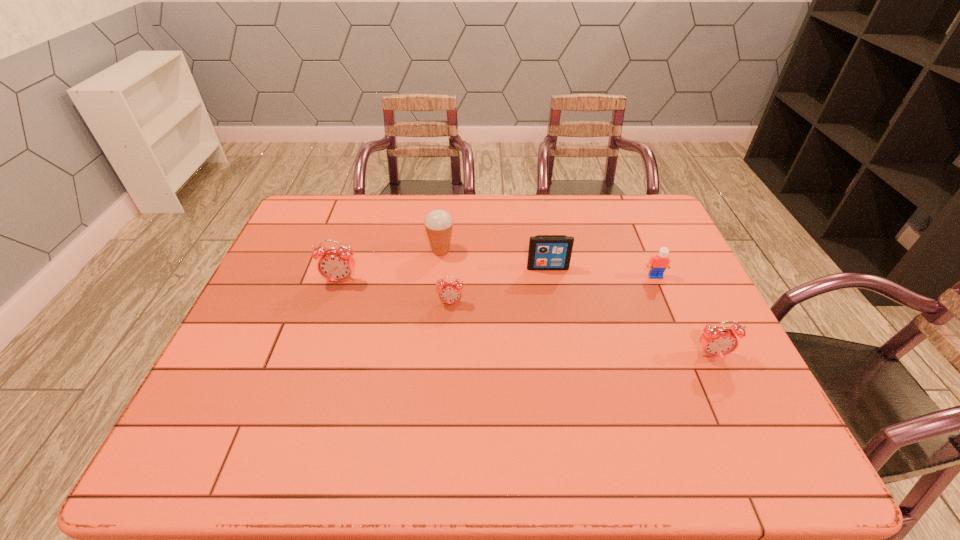
The image size is (960, 540). I want to click on blank space located 0.290m on the face of the tallest alarm clock, so click(310, 372).

Identify the location of free space located on the face of the second alarm clock from right to left. The image size is (960, 540). (450, 324).

What are the coordinates of `vacant space situated 0.080m on the face of the second shortest alarm clock` in the screenshot? It's located at (728, 390).

You are a GUI agent. You are given a task and a screenshot of the screen. Output one action in this format:
    pyautogui.click(x=<x>, y=<y>)
    Task: Click on the vacant space located 0.240m on the face of the Lego
    This screenshot has width=960, height=540.
    Given the screenshot: What is the action you would take?
    pyautogui.click(x=684, y=345)

At what (x,y) coordinates should I click in order to perform the action: click on vacant space located on the front screen of the third object from right to left. Please return your answer as a coordinate pair (x, y). This screenshot has width=960, height=540. Looking at the image, I should click on (554, 302).

Locate an element on the screen. This screenshot has height=540, width=960. vacant region located on the left of the icecream is located at coordinates (356, 251).

Locate an element on the screen. alarm clock that is at the right edge is located at coordinates (716, 341).

The width and height of the screenshot is (960, 540). I want to click on Lego that is at the right edge, so click(x=658, y=264).

Locate an element on the screen. The height and width of the screenshot is (540, 960). free spot at the far edge of the desktop is located at coordinates (540, 199).

This screenshot has height=540, width=960. In order to click on free spot at the near edge of the desktop in this screenshot , I will do pos(362,402).